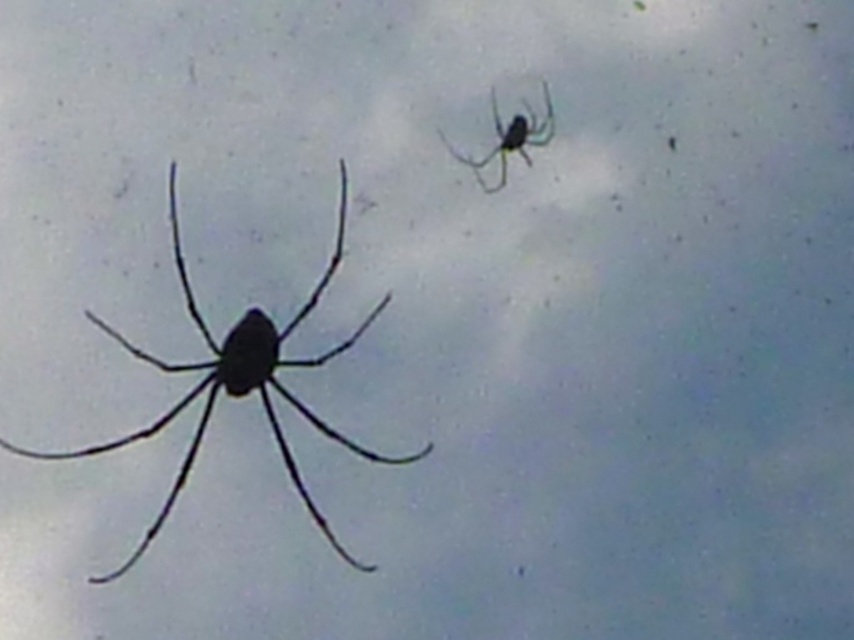
You are an entomologist observing two spiders in a glass enclosure. You notice the black matte spider at left and the green glossy spider at upper right. Which spider has a greater width according to your measurements?

The black matte spider at left has a greater width than the green glossy spider at upper right according to the description.

You are an entomologist observing two spiders in a glass enclosure. The glass has some dust particles on it. You notice the black matte spider at left and the green glossy spider at upper right. Which spider is positioned lower in the enclosure?

The black matte spider at left is positioned lower in the enclosure as it is below the green glossy spider at upper right.